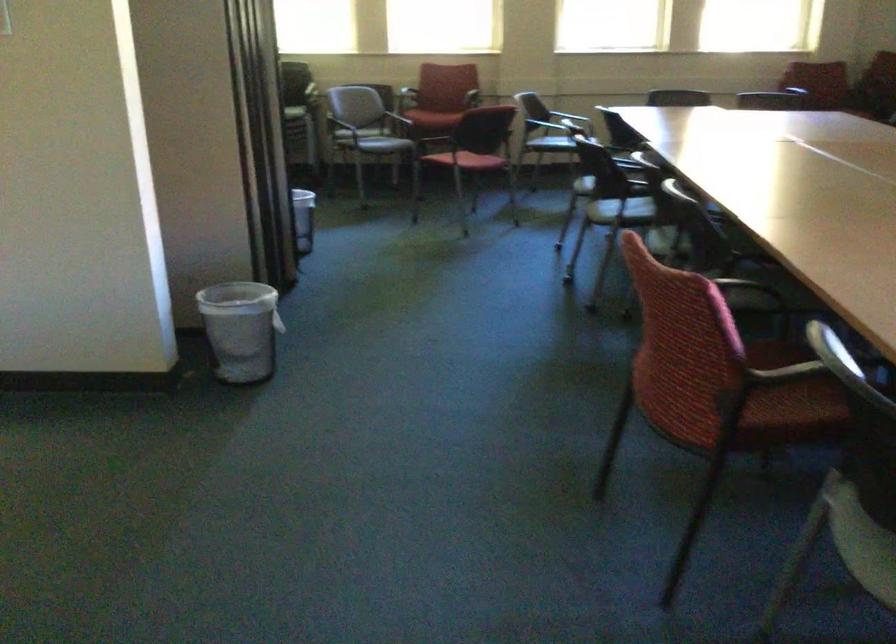
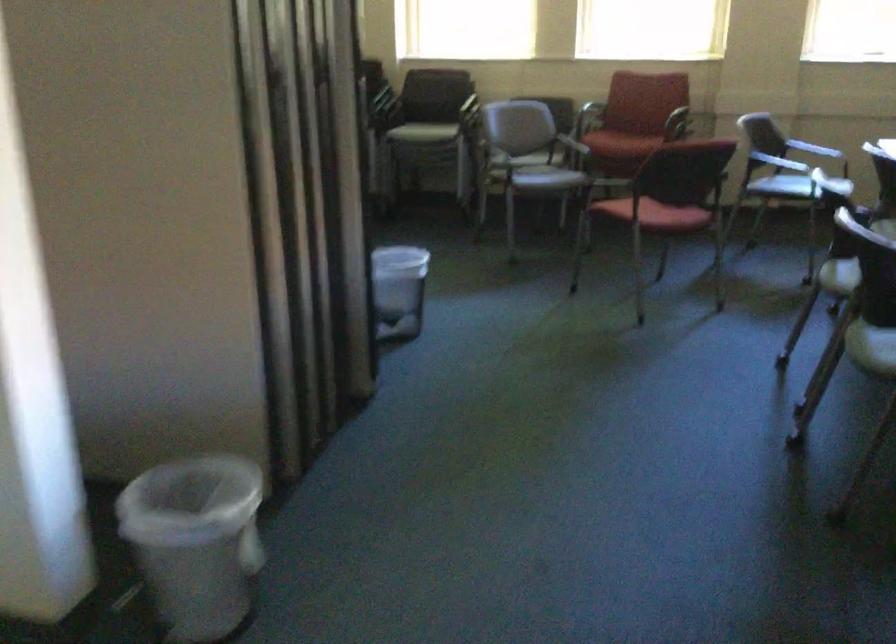
Question: Which direction would the cameraman need to move to produce the second image? Reply with the corresponding letter.

Choices:
 (A) Left
 (B) Right
 (C) Forward
 (D) Backward

Answer: (C)